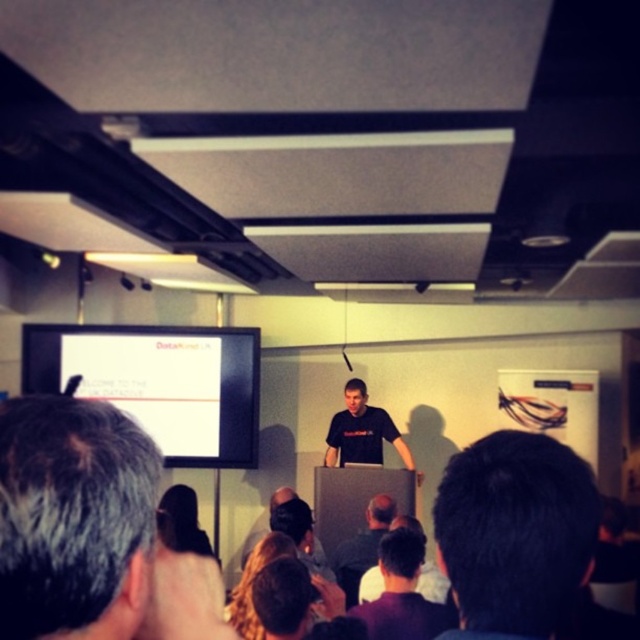
Question: Can you confirm if gray hair at upper left is positioned above black matte shirt at center?

Choices:
 (A) yes
 (B) no

Answer: (A)

Question: Among these points, which one is nearest to the camera?

Choices:
 (A) (336, 426)
 (B) (113, 396)

Answer: (B)

Question: Which point is closer to the camera?

Choices:
 (A) (356, 440)
 (B) (196, 369)

Answer: (A)

Question: Can you confirm if gray hair at upper left is wider than dark brown hair at center?

Choices:
 (A) yes
 (B) no

Answer: (B)

Question: Estimate the real-world distances between objects in this image. Which object is farther from the gray hair at upper left?

Choices:
 (A) dark brown hair at center
 (B) black matte shirt at center

Answer: (B)

Question: Is dark brown hair at center above white matte projection screen at upper center?

Choices:
 (A) no
 (B) yes

Answer: (B)